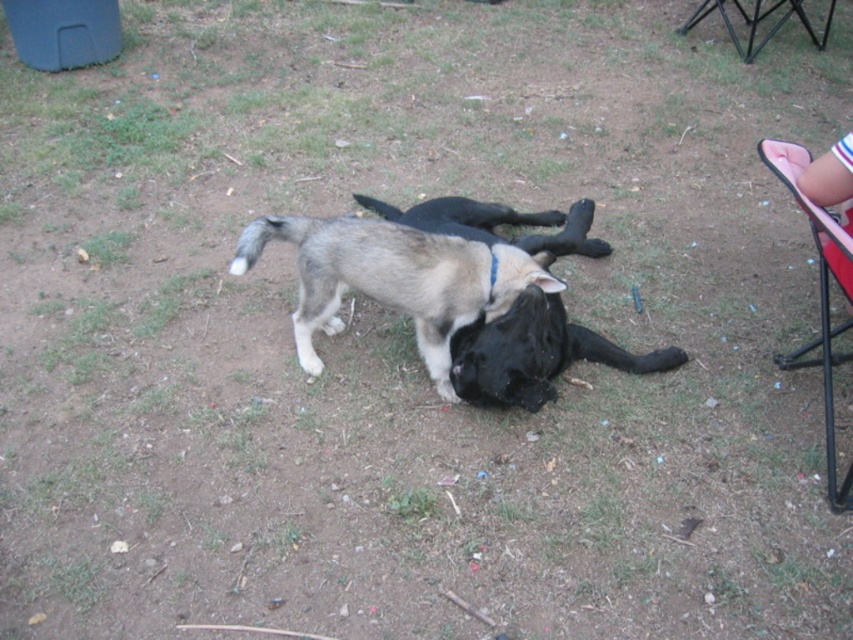
Question: Is gray fur dog at center positioned before pink fabric chair at right?

Choices:
 (A) yes
 (B) no

Answer: (B)

Question: Which of the following is the closest to the observer?

Choices:
 (A) black matte dog at center
 (B) pink fabric chair at right
 (C) black metal chair at upper right

Answer: (B)

Question: Where is black matte dog at center located in relation to black metal chair at upper right in the image?

Choices:
 (A) above
 (B) below

Answer: (B)

Question: Does black matte dog at center appear on the left side of black metal chair at upper right?

Choices:
 (A) yes
 (B) no

Answer: (A)

Question: Which object appears closest to the camera in this image?

Choices:
 (A) black matte dog at center
 (B) gray fur dog at center
 (C) pink fabric chair at right
 (D) black metal chair at upper right

Answer: (C)

Question: Which point is closer to the camera?

Choices:
 (A) pink fabric chair at right
 (B) black matte dog at center
 (C) black fur dog at center
 (D) gray fur dog at center

Answer: (A)